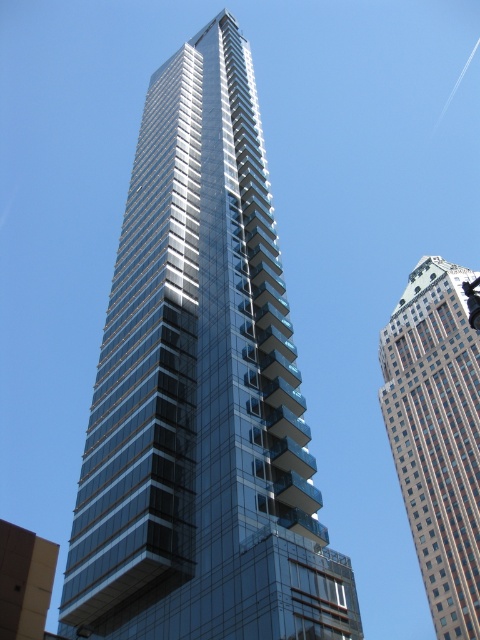
Describe the element at coordinates (201, 392) in the screenshot. Image resolution: width=480 pixels, height=640 pixels. I see `glassy metallic skyscraper at center` at that location.

I want to click on glassy metallic skyscraper at center, so tap(201, 392).

Locate an element on the screen. glassy metallic skyscraper at center is located at coordinates (201, 392).